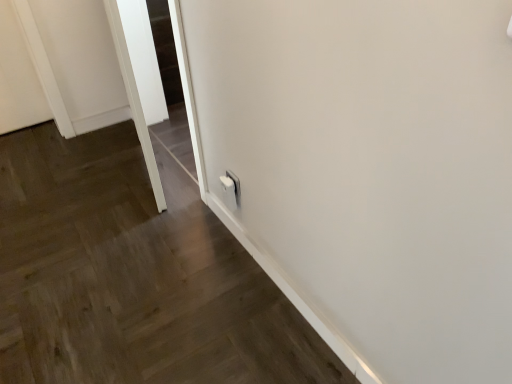
What is the approximate width of transparent glass door at lower left?

The width of transparent glass door at lower left is 10.87 inches.

This screenshot has width=512, height=384. Find the location of `transparent glass door at lower left`. transparent glass door at lower left is located at coordinates (134, 98).

What do you see at coordinates (134, 98) in the screenshot? I see `transparent glass door at lower left` at bounding box center [134, 98].

I want to click on transparent glass door at lower left, so click(x=134, y=98).